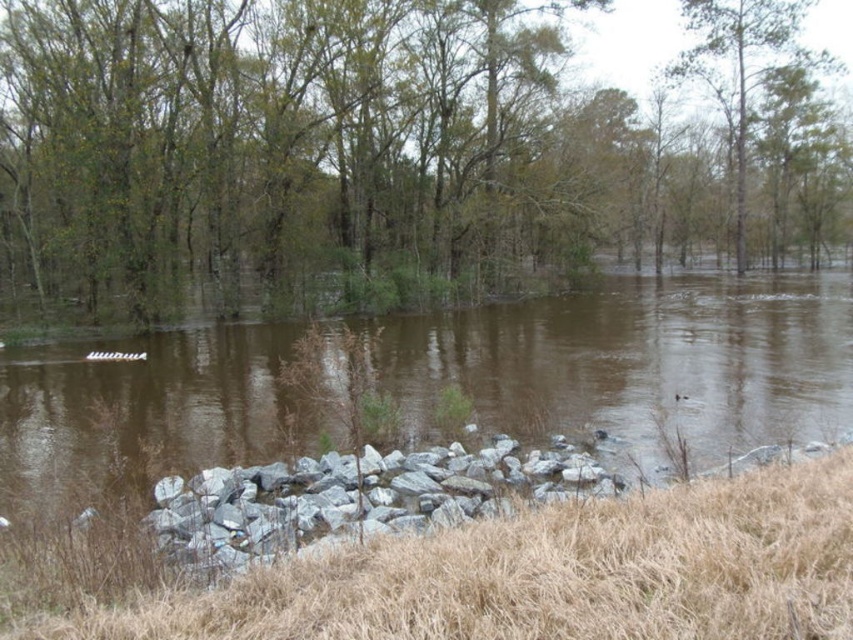
Is brown leafy tree at center further to camera compared to green leafy tree at upper center?

No.

Consider the image. Can you confirm if brown leafy tree at center is positioned below green leafy tree at upper center?

Yes.

Who is more distant from viewer, (x=117, y=221) or (x=715, y=92)?

Point (x=715, y=92)

Where is `brown leafy tree at center`? brown leafy tree at center is located at coordinates (392, 150).